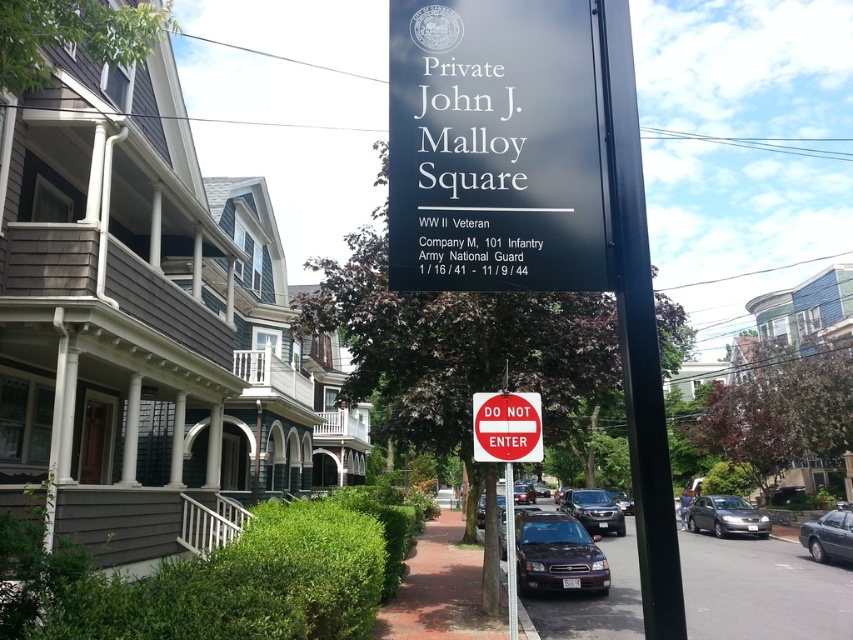
Question: Estimate the real-world distances between objects in this image. Which object is closer to the matte gray sedan at center?

Choices:
 (A) satin black sedan at center
 (B) metallic gray sedan at lower right
 (C) red plastic sign at center

Answer: (B)

Question: Does matte gray sedan at center appear over black metal pole at center?

Choices:
 (A) no
 (B) yes

Answer: (A)

Question: Where is red plastic sign at center located in relation to shiny black sedan at center in the image?

Choices:
 (A) below
 (B) above

Answer: (B)

Question: Estimate the real-world distances between objects in this image. Which object is closer to the shiny black sedan at center?

Choices:
 (A) black metal pole at center
 (B) matte gray sedan at center

Answer: (B)

Question: Which point is closer to the camera?

Choices:
 (A) (518, 573)
 (B) (523, 428)

Answer: (B)

Question: Is red plastic sign at center wider than satin black suv at center?

Choices:
 (A) yes
 (B) no

Answer: (B)